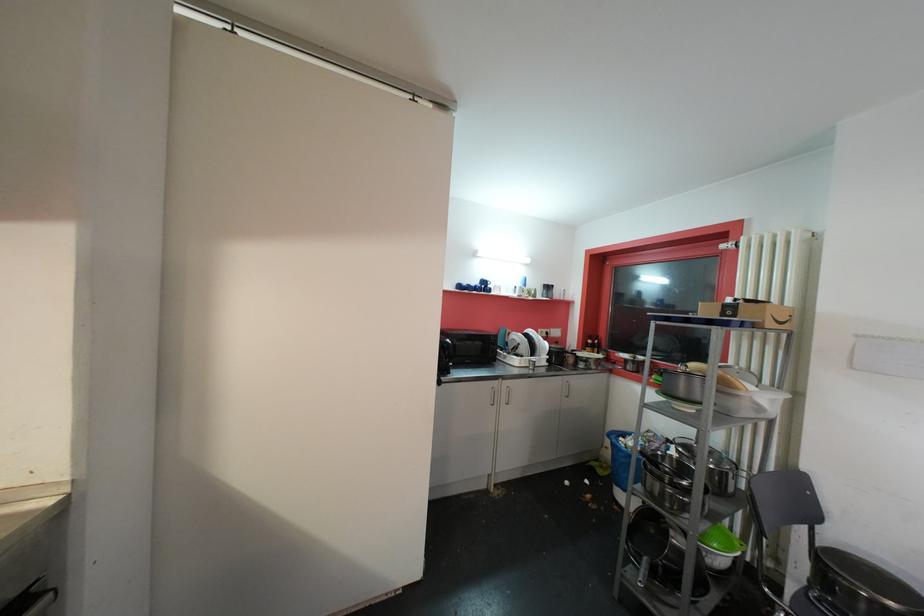
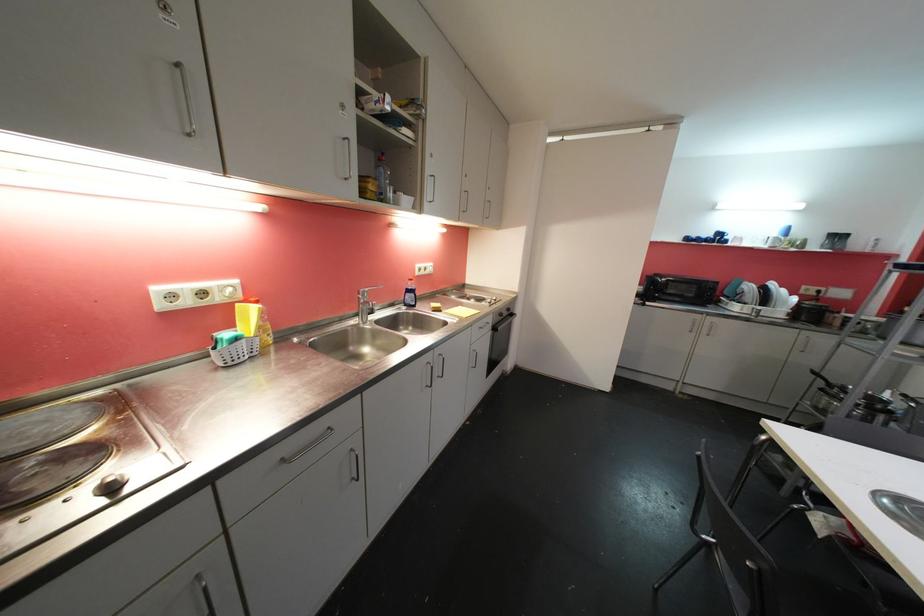
Where in the second image is the point corresponding to point 524,286 from the first image?

(781, 236)